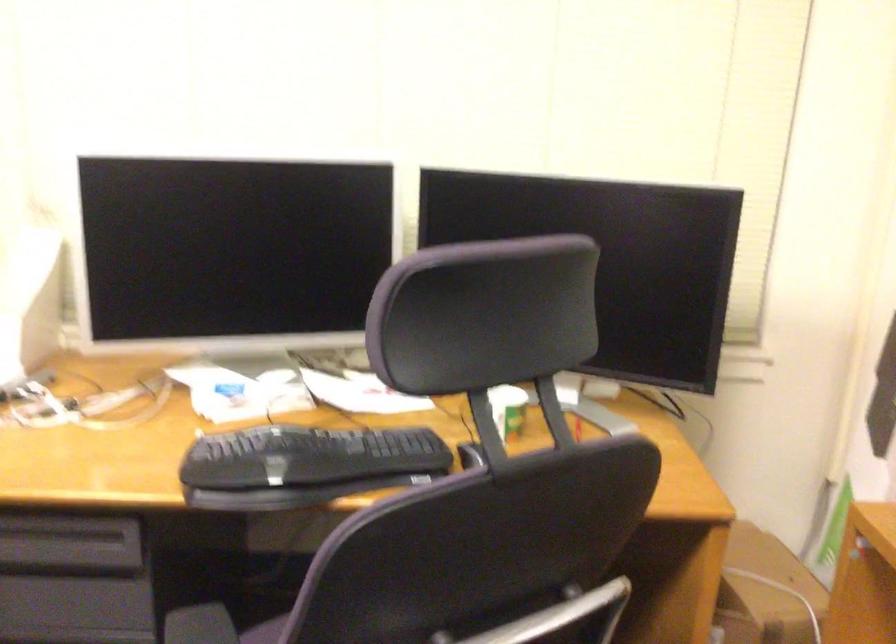
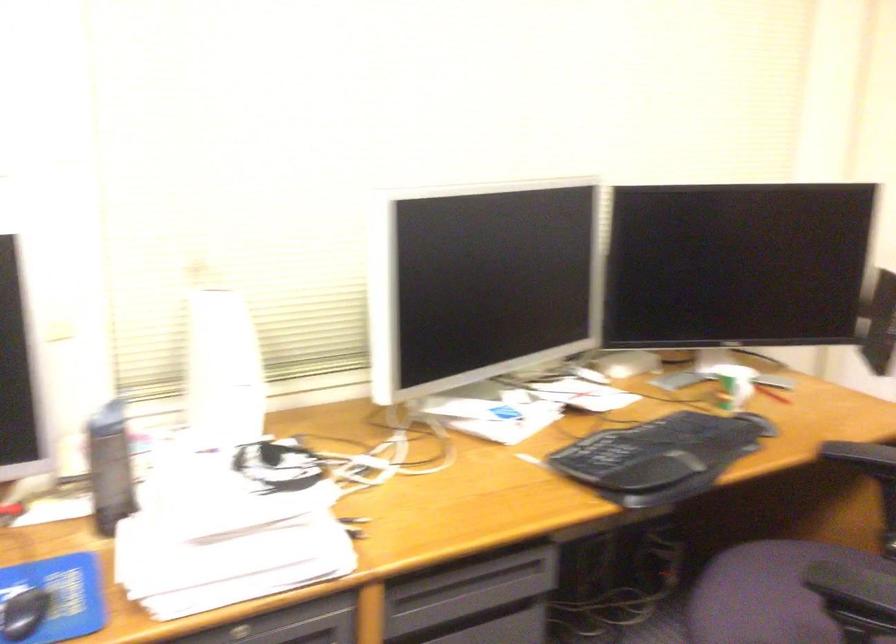
Question: In a continuous first-person perspective shot, in which direction is the camera moving?

Choices:
 (A) Left
 (B) Right
 (C) Forward
 (D) Backward

Answer: (A)